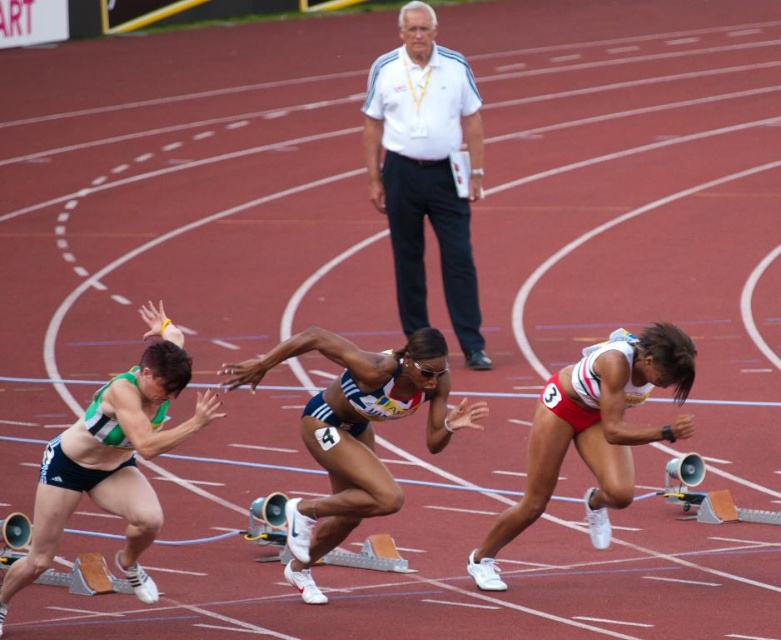
Is white smooth shirt at upper center thinner than white athletic uniform at center?

Yes.

Between point (405, 305) and point (375, 480), which one is positioned behind?

Point (405, 305)

Between point (469, 108) and point (257, 365), which one is positioned in front?

Point (257, 365) is in front.

This screenshot has width=781, height=640. I want to click on white smooth shirt at upper center, so click(426, 170).

Does green matte shorts at left appear under white matte running shoe at lower right?

Yes.

Between green matte shorts at left and white matte running shoe at lower right, which one is positioned lower?

Positioned lower is green matte shorts at left.

The width and height of the screenshot is (781, 640). Find the location of `green matte shorts at left`. green matte shorts at left is located at coordinates (113, 458).

Between white athletic uniform at center and green matte shorts at left, which one is positioned lower?

green matte shorts at left is lower down.

Does white athletic uniform at center have a greater height compared to green matte shorts at left?

No.

Is point (384, 376) positioned in front of point (186, 360)?

No.

In order to click on white athletic uniform at center in this screenshot , I will do `click(355, 433)`.